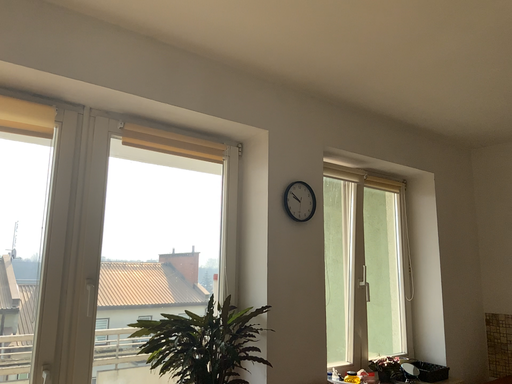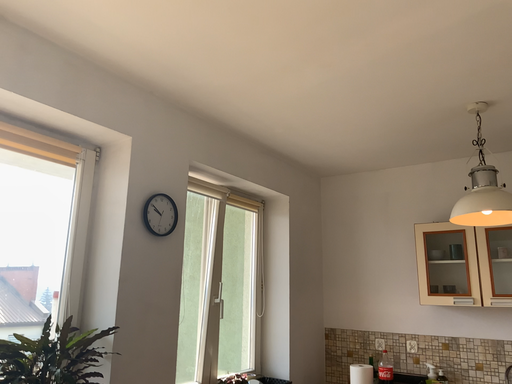
Question: Which way did the camera rotate in the video?

Choices:
 (A) rotated right
 (B) rotated left

Answer: (A)